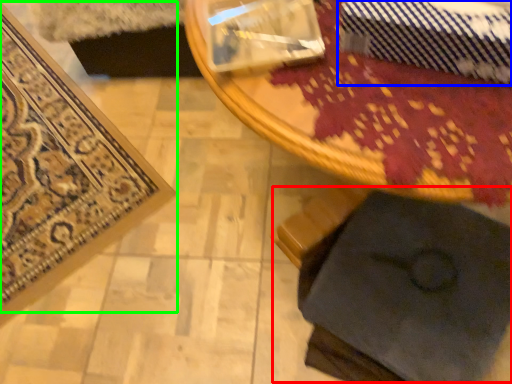
Question: Which is farther away from swivel chair (highlighted by a red box)? tie (highlighted by a blue box) or mat (highlighted by a green box)?

Choices:
 (A) tie
 (B) mat

Answer: (B)